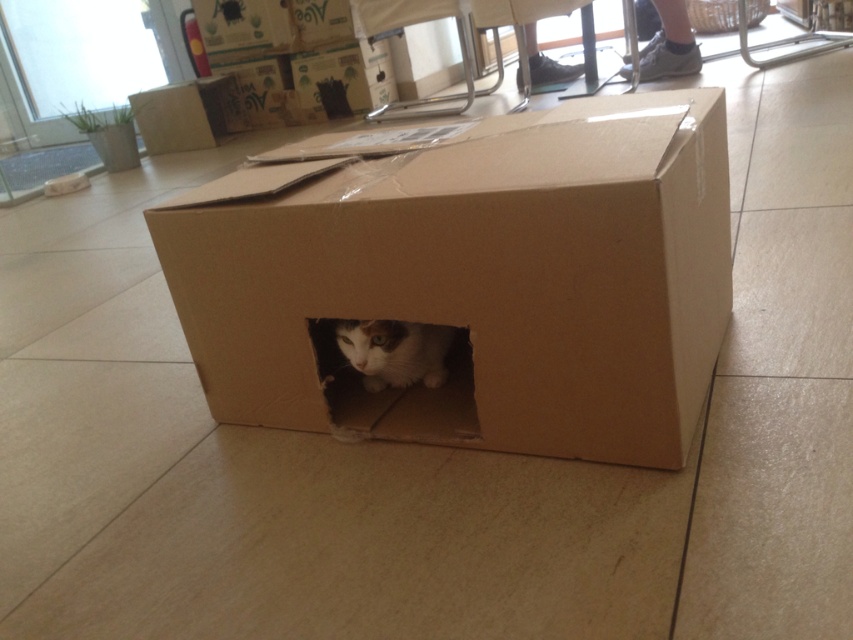
You are a delivery person who just arrived at the scene. You need to pick up the brown cardboard box at center without disturbing the white fur cat at center. Is the box above or below the cat?

The brown cardboard box at center is positioned over the white fur cat at center, so the box is above the cat.

Please provide the exact coordinates of the brown cardboard box at center in the image. The coordinates should be in the format of a point with two decimal places, such as point (474, 280). The scene is a cardboard box on a tiled floor with a cat visible through a hole, and there are stacked boxes labeled Aloe in the background.

The brown cardboard box at center is located at point (474, 280).